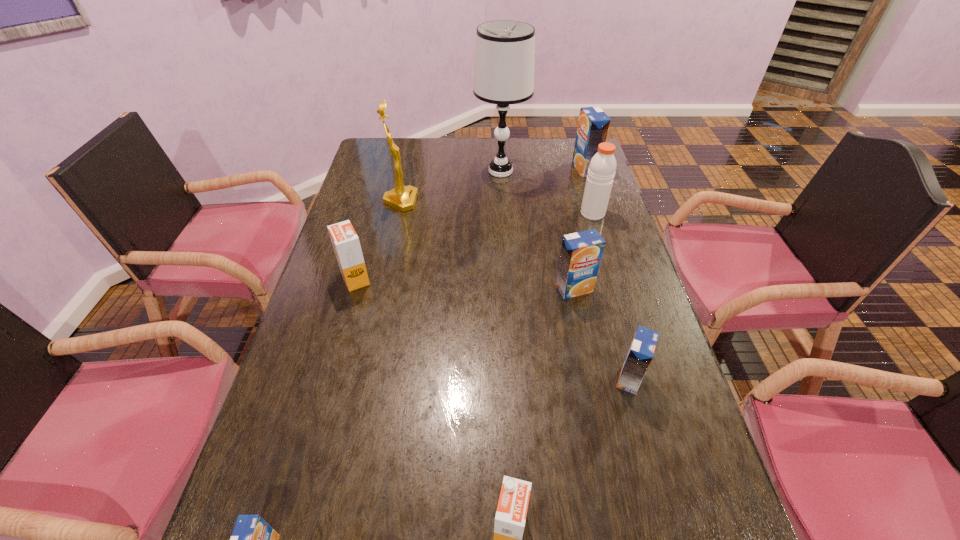
At what (x,y) coordinates should I click in order to perform the action: click on the third nearest object. Please return your answer as a coordinate pair (x, y). This screenshot has height=540, width=960. Looking at the image, I should click on (640, 354).

Locate an element on the screen. The width and height of the screenshot is (960, 540). the fourth farthest orange_juice is located at coordinates (640, 354).

The height and width of the screenshot is (540, 960). What are the coordinates of `vacant space situated on the back of the table lamp` in the screenshot? It's located at (498, 140).

Locate an element on the screen. This screenshot has height=540, width=960. free space located 0.300m on the front-facing side of the golden award is located at coordinates (505, 201).

This screenshot has width=960, height=540. What are the coordinates of `free spot located 0.330m on the left of the shaker` in the screenshot? It's located at (481, 213).

Locate an element on the screen. This screenshot has width=960, height=540. vacant area located 0.120m on the left of the biggest blue orange_juice is located at coordinates (541, 168).

Where is `vacant space located on the left of the third smallest blue orange_juice`? The height and width of the screenshot is (540, 960). vacant space located on the left of the third smallest blue orange_juice is located at coordinates (414, 289).

Image resolution: width=960 pixels, height=540 pixels. What are the coordinates of `free region located on the back of the left orange orange juice` in the screenshot? It's located at (372, 220).

Locate an element on the screen. vacant space located 0.130m on the left of the seventh farthest object is located at coordinates (558, 379).

This screenshot has height=540, width=960. Identify the location of table lamp that is at the far edge. (505, 49).